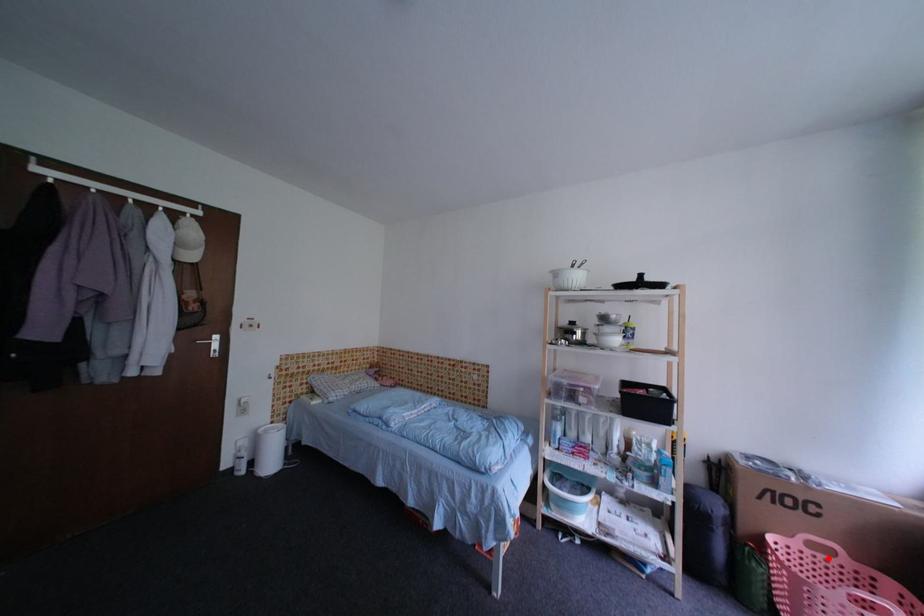
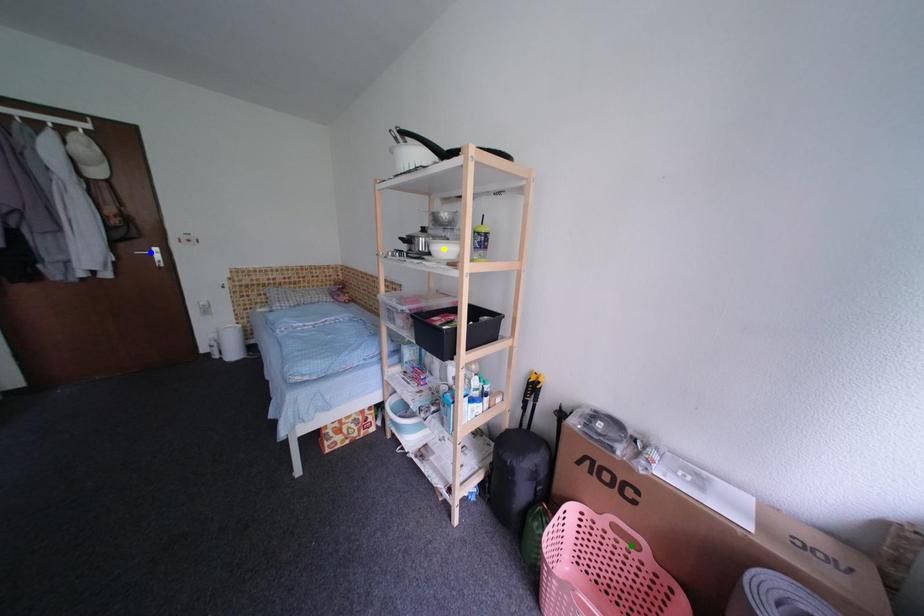
Question: I am providing you with two images of the same scene from different viewpoints. A red point is marked on the first image. You are given multiple points on the second image. Which mark in image 2 goes with the point in image 1?

Choices:
 (A) green point
 (B) yellow point
 (C) blue point

Answer: (A)